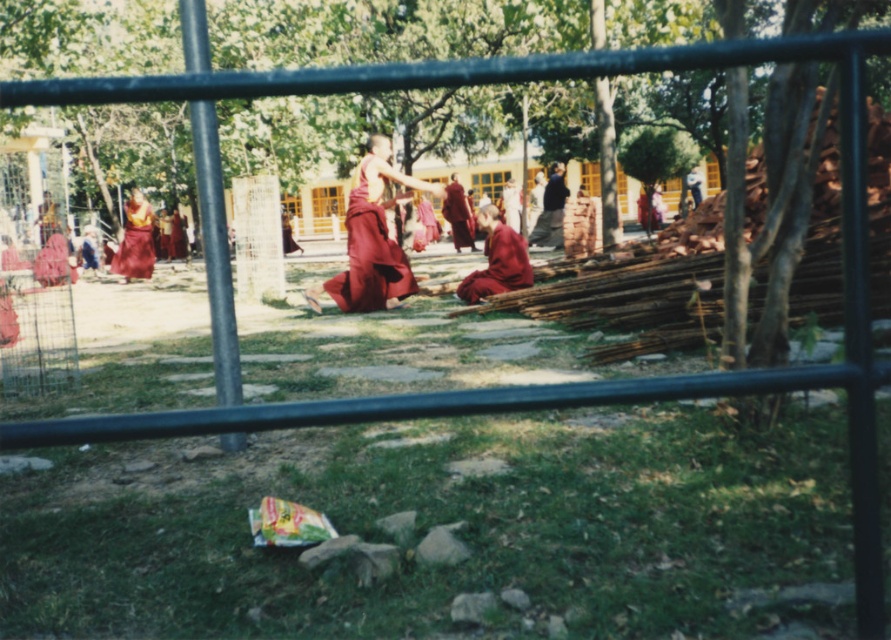
Which of these two, maroon silk robe at center or matte red robe at center, stands taller?

maroon silk robe at center

Does maroon silk robe at center appear on the right side of matte red robe at center?

No, maroon silk robe at center is not to the right of matte red robe at center.

What do you see at coordinates (369, 257) in the screenshot? This screenshot has height=640, width=891. I see `maroon silk robe at center` at bounding box center [369, 257].

I want to click on maroon silk robe at center, so click(369, 257).

Is point (468, 275) farther from camera compared to point (541, 214)?

That is False.

Is matte red robe at center to the right of dark gray fabric at center from the viewer's perspective?

In fact, matte red robe at center is to the left of dark gray fabric at center.

This screenshot has height=640, width=891. What are the coordinates of `matte red robe at center` in the screenshot? It's located at (497, 266).

Where is `matte red robe at center`? The image size is (891, 640). matte red robe at center is located at coordinates (497, 266).

Can you confirm if maroon silk robe at center is smaller than dark gray fabric at center?

No.

Does maroon silk robe at center have a greater width compared to dark gray fabric at center?

Yes.

The image size is (891, 640). What do you see at coordinates (369, 257) in the screenshot? I see `maroon silk robe at center` at bounding box center [369, 257].

You are a GUI agent. You are given a task and a screenshot of the screen. Output one action in this format:
    pyautogui.click(x=<x>, y=<y>)
    Task: Click on the maroon silk robe at center
    The image size is (891, 640).
    Given the screenshot: What is the action you would take?
    pyautogui.click(x=369, y=257)